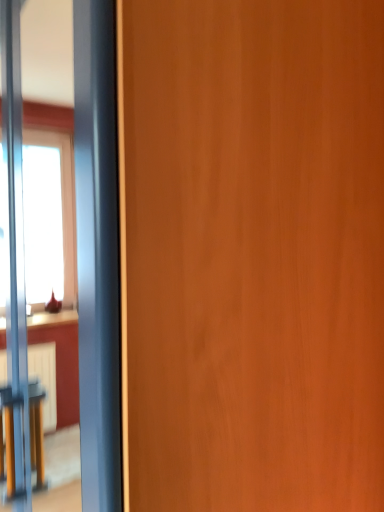
Describe the element at coordinates (255, 254) in the screenshot. I see `wooden door at center` at that location.

You are a GUI agent. You are given a task and a screenshot of the screen. Output one action in this format:
    pyautogui.click(x=<x>, y=<y>)
    Task: Click on the wooden door at center
    The image size is (384, 512).
    Given the screenshot: What is the action you would take?
    pyautogui.click(x=255, y=254)

The width and height of the screenshot is (384, 512). In order to click on wooden door at center in this screenshot , I will do `click(255, 254)`.